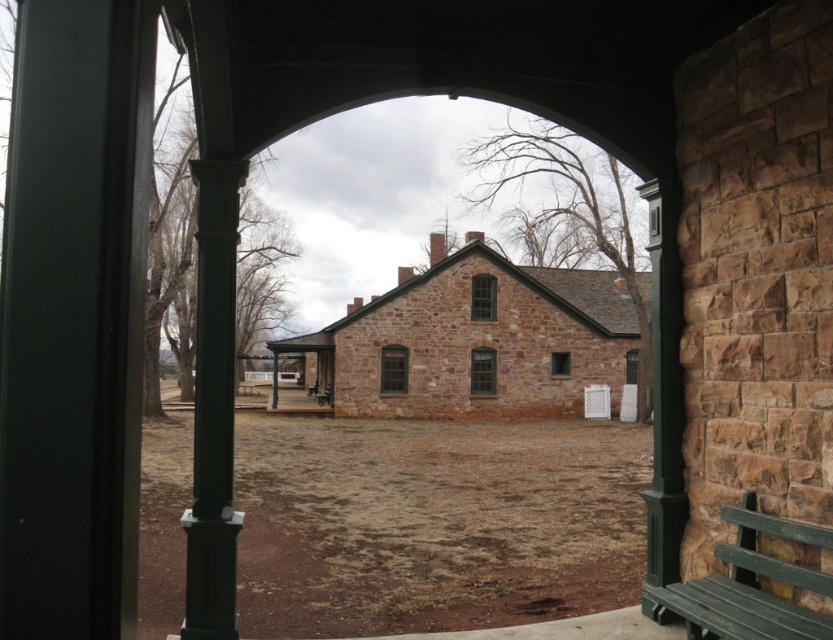
Is point (225, 508) farther from viewer compared to point (722, 593)?

Yes, it is behind point (722, 593).

Can you confirm if green painted wood post at left is positioned above green wood bench at lower right?

No.

What do you see at coordinates (213, 406) in the screenshot?
I see `green painted wood post at left` at bounding box center [213, 406].

The image size is (833, 640). I want to click on green painted wood post at left, so click(x=213, y=406).

In the scene shown: Who is shorter, brown dirt field at center or green painted wood post at left?

Standing shorter between the two is green painted wood post at left.

Is point (417, 492) positioned after point (201, 625)?

That is True.

What are the coordinates of `brown dirt field at center` in the screenshot? It's located at (434, 522).

Can you confirm if brown dirt field at center is smaller than green wood bench at lower right?

Actually, brown dirt field at center might be larger than green wood bench at lower right.

Can you confirm if brown dirt field at center is taller than green wood bench at lower right?

Yes.

This screenshot has width=833, height=640. I want to click on brown dirt field at center, so click(434, 522).

Locate an element on the screen. The image size is (833, 640). brown dirt field at center is located at coordinates (434, 522).